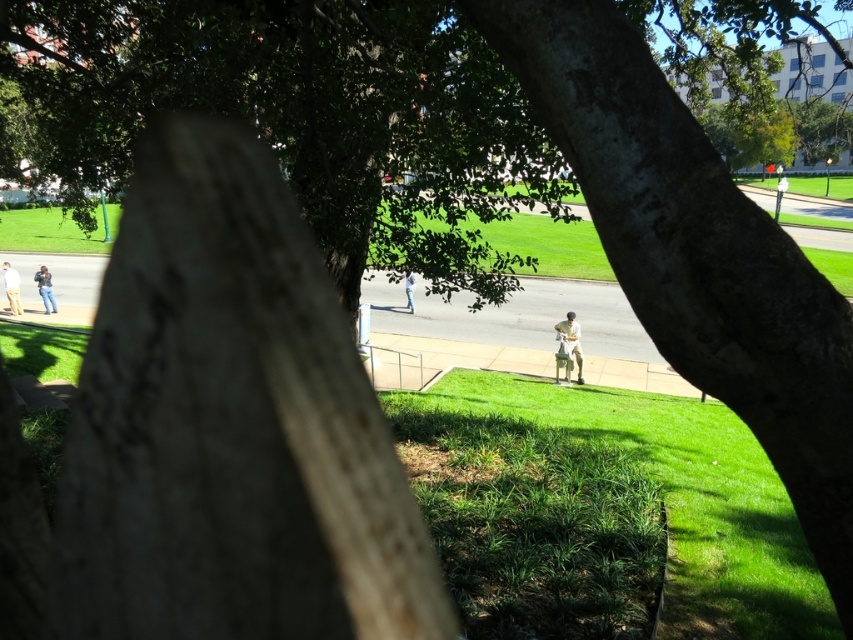
You are standing at the start of the pathway and see a person wearing khaki cotton pants at center and light blue jeans at left. Which clothing item is closer to the right side of the pathway?

The khaki cotton pants at center is positioned on the right side of light blue jeans at left, so the khaki cotton pants at center is closer to the right side of the pathway.

You are a photographer trying to capture the entire pathway in your shot. The khaki cotton pants at center and light blue jeans at left are blocking your view. Which clothing item should you move to ensure the pathway is fully visible?

You should move the khaki cotton pants at center because it is thinner and less obstructive compared to the light blue jeans at left, allowing you to maintain more of the pathway in your shot while clearing the view.

You are standing at the point marked as point (x=572, y=339). What object is located exactly at your current position?

The khaki cotton pants at center is located exactly at point (x=572, y=339).